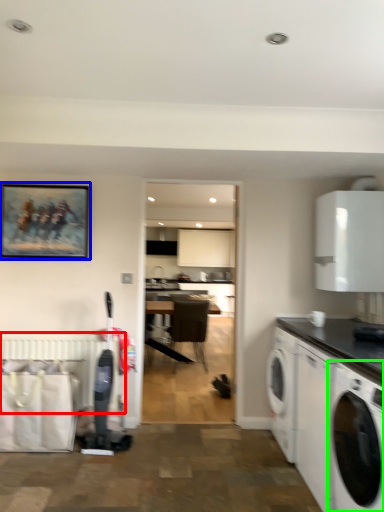
Question: Which is nearer to the radiator (highlighted by a red box)? picture frame (highlighted by a blue box) or washing machine (highlighted by a green box).

Choices:
 (A) picture frame
 (B) washing machine

Answer: (A)